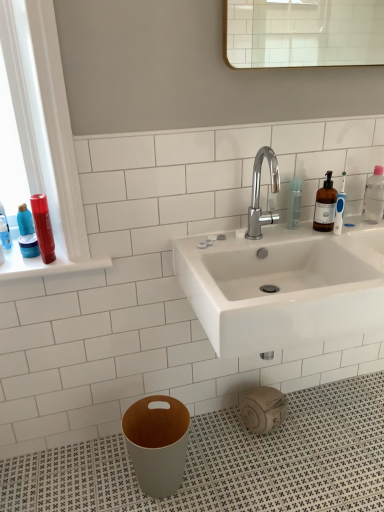
What do you see at coordinates (374, 196) in the screenshot? This screenshot has height=512, width=384. I see `clear plastic bottle at right` at bounding box center [374, 196].

What do you see at coordinates (46, 264) in the screenshot?
I see `matte plastic bottles at left` at bounding box center [46, 264].

Locate an element on the screen. This screenshot has height=512, width=384. matte plastic bottles at left is located at coordinates (46, 264).

Locate an element on the screen. The image size is (384, 512). white glossy sink at center is located at coordinates (282, 281).

Describe the element at coordinates (294, 203) in the screenshot. I see `clear plastic bottle at upper right` at that location.

You are a GUI agent. You are given a task and a screenshot of the screen. Output one action in this format:
    pyautogui.click(x=<x>, y=<y>)
    Task: Click on the clear plastic bottle at right
    Image resolution: width=384 pixels, height=512 pixels.
    Given the screenshot: What is the action you would take?
    pyautogui.click(x=374, y=196)

From a real-world perspective, is shiny red hair spray at left physically located above or below chrome metallic faucet at center?

shiny red hair spray at left is situated lower than chrome metallic faucet at center in the real world.

Considering the relative sizes of shiny red hair spray at left and chrome metallic faucet at center in the image provided, is shiny red hair spray at left bigger than chrome metallic faucet at center?

No, shiny red hair spray at left is not bigger than chrome metallic faucet at center.

Can you confirm if shiny red hair spray at left is thinner than chrome metallic faucet at center?

Indeed, shiny red hair spray at left has a lesser width compared to chrome metallic faucet at center.

Considering the positions of point (48, 218) and point (262, 221), is point (48, 218) closer or farther from the camera than point (262, 221)?

Clearly, point (48, 218) is closer to the camera than point (262, 221).

Is point (42, 258) positioned in front of point (261, 262)?

Yes, point (42, 258) is in front of point (261, 262).

Choose the correct answer: Is shiny red hair spray at left inside white glossy sink at center or outside it?

shiny red hair spray at left exists outside the volume of white glossy sink at center.

Is shiny red hair spray at left beside white glossy sink at center?

No, shiny red hair spray at left is not beside white glossy sink at center.

Which is more to the left, shiny red hair spray at left or white glossy sink at center?

Positioned to the left is shiny red hair spray at left.

Considering their positions, is white glossy sink at center located in front of or behind matte plastic bottles at left?

white glossy sink at center is positioned closer to the viewer than matte plastic bottles at left.

Is white glossy sink at center facing away from matte plastic bottles at left?

No, white glossy sink at center is not facing the opposite direction of matte plastic bottles at left.

From the image's perspective, does white glossy sink at center appear lower than matte plastic bottles at left?

Yes.

Is white glossy sink at center outside of matte plastic bottles at left?

Yes, white glossy sink at center is outside of matte plastic bottles at left.

Is chrome metallic faucet at center positioned far away from shiny red hair spray at left?

Actually, chrome metallic faucet at center and shiny red hair spray at left are a little close together.

Is chrome metallic faucet at center wider than shiny red hair spray at left?

Correct, the width of chrome metallic faucet at center exceeds that of shiny red hair spray at left.

Does chrome metallic faucet at center have a larger size compared to shiny red hair spray at left?

Yes, chrome metallic faucet at center is bigger than shiny red hair spray at left.

Could shiny red hair spray at left be considered to be inside chrome metallic faucet at center?

No, shiny red hair spray at left is not surrounded by chrome metallic faucet at center.

Is white glossy sink at center positioned with its back to clear plastic bottle at upper right?

white glossy sink at center is not turned away from clear plastic bottle at upper right.

From a real-world perspective, between white glossy sink at center and clear plastic bottle at upper right, who is vertically lower?

white glossy sink at center, from a real-world perspective.

Consider the image. Is white glossy sink at center not close to clear plastic bottle at upper right?

No, white glossy sink at center is not far from clear plastic bottle at upper right.

Based on the photo, based on their positions, is shiny red hair spray at left located to the left or right of matte plastic bottles at left?

From the image, it's evident that shiny red hair spray at left is to the right of matte plastic bottles at left.

In terms of width, does shiny red hair spray at left look wider or thinner when compared to matte plastic bottles at left?

Considering their sizes, shiny red hair spray at left looks slimmer than matte plastic bottles at left.

Measure the distance from shiny red hair spray at left to matte plastic bottles at left.

A distance of 3.08 inches exists between shiny red hair spray at left and matte plastic bottles at left.

Which is closer to the camera, (261, 147) or (262, 238)?

Point (261, 147)

Considering the relative positions of chrome metallic faucet at center and white glossy sink at center in the image provided, is chrome metallic faucet at center to the left of white glossy sink at center from the viewer's perspective?

Correct, you'll find chrome metallic faucet at center to the left of white glossy sink at center.

From a real-world perspective, is chrome metallic faucet at center positioned under white glossy sink at center based on gravity?

No, from a real-world perspective, chrome metallic faucet at center is not beneath white glossy sink at center.

Does chrome metallic faucet at center have a smaller size compared to white glossy sink at center?

Correct, chrome metallic faucet at center occupies less space than white glossy sink at center.

I want to click on toiletry behind the chrome metallic faucet at center, so click(43, 227).

Where is `sink on the right of shiny red hair spray at left`? This screenshot has width=384, height=512. sink on the right of shiny red hair spray at left is located at coordinates (282, 281).

When comparing their distances from matte plastic bottles at left, does chrome metallic faucet at center or clear plastic bottle at right seem closer?

Based on the image, chrome metallic faucet at center appears to be nearer to matte plastic bottles at left.

Based on their spatial positions, is clear plastic bottle at upper right or shiny red hair spray at left further from matte plastic bottles at left?

clear plastic bottle at upper right lies further to matte plastic bottles at left than the other object.

Which object lies further to the anchor point shiny red hair spray at left, clear plastic bottle at upper right or white glossy sink at center?

clear plastic bottle at upper right is further to shiny red hair spray at left.

Estimate the real-world distances between objects in this image. Which object is further from shiny red hair spray at left, white glossy sink at center or chrome metallic faucet at center?

white glossy sink at center lies further to shiny red hair spray at left than the other object.

From the image, which object appears to be farther from white glossy sink at center, clear plastic bottle at right or clear plastic bottle at upper right?

Among the two, clear plastic bottle at right is located further to white glossy sink at center.

From the picture: From the image, which object appears to be farther from shiny red hair spray at left, matte plastic bottles at left or white glossy sink at center?

white glossy sink at center lies further to shiny red hair spray at left than the other object.

Estimate the real-world distances between objects in this image. Which object is closer to white glossy sink at center, shiny red hair spray at left or chrome metallic faucet at center?

The object closer to white glossy sink at center is chrome metallic faucet at center.

Looking at the image, which one is located further to white glossy sink at center, clear plastic bottle at upper right or chrome metallic faucet at center?

clear plastic bottle at upper right.

In order to click on tap positioned between white glossy sink at center and clear plastic bottle at right from near to far in this screenshot , I will do `click(259, 193)`.

At what (x,y) coordinates should I click in order to perform the action: click on toiletry between matte plastic bottles at left and clear plastic bottle at right from left to right. Please return your answer as a coordinate pair (x, y). Looking at the image, I should click on (43, 227).

Where is `sink located between matte plastic bottles at left and clear plastic bottle at right in the left-right direction`? sink located between matte plastic bottles at left and clear plastic bottle at right in the left-right direction is located at coordinates (282, 281).

Locate an element on the screen. The width and height of the screenshot is (384, 512). tap located between shiny red hair spray at left and clear plastic bottle at right in the left-right direction is located at coordinates (259, 193).